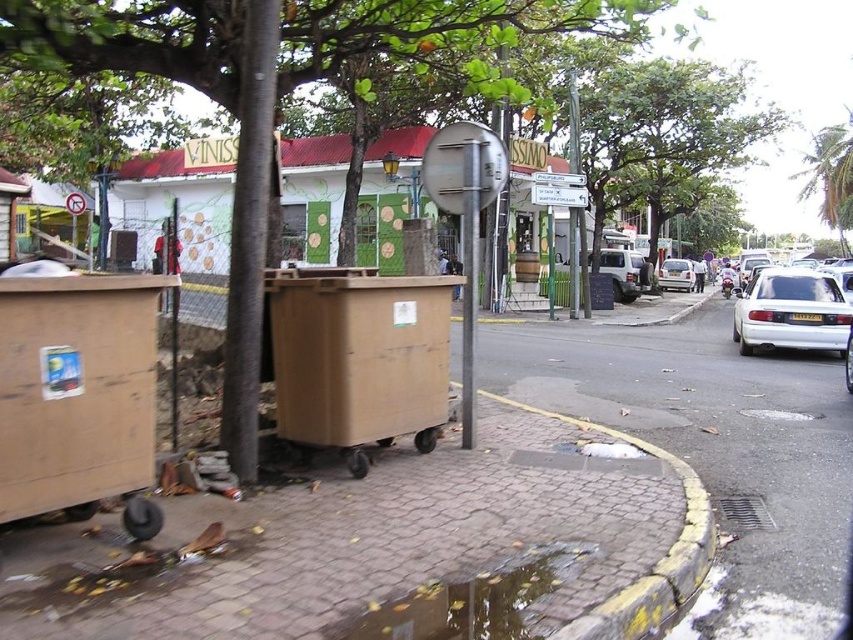
Is reflective wet pavement at lower center taller than green leafy tree at upper center?

No, reflective wet pavement at lower center is not taller than green leafy tree at upper center.

You are a GUI agent. You are given a task and a screenshot of the screen. Output one action in this format:
    pyautogui.click(x=<x>, y=<y>)
    Task: Click on the reflective wet pavement at lower center
    The image size is (853, 640).
    Given the screenshot: What is the action you would take?
    pyautogui.click(x=469, y=602)

Which is in front, point (450, 584) or point (844, 163)?

Positioned in front is point (450, 584).

At what (x,y) coordinates should I click in order to perform the action: click on reflective wet pavement at lower center. Please return your answer as a coordinate pair (x, y). The image size is (853, 640). Looking at the image, I should click on (469, 602).

The image size is (853, 640). Describe the element at coordinates (715, 449) in the screenshot. I see `brick pavement at center` at that location.

Consider the image. Does brick pavement at center have a lesser width compared to white glossy sedan at right?

Yes, brick pavement at center is thinner than white glossy sedan at right.

The width and height of the screenshot is (853, 640). What are the coordinates of `brick pavement at center` in the screenshot? It's located at (715, 449).

Which is more to the left, brown cardboard at center or green leafy tree at center?

From the viewer's perspective, green leafy tree at center appears more on the left side.

Can you confirm if brown cardboard at center is shorter than green leafy tree at center?

No, brown cardboard at center is not shorter than green leafy tree at center.

Which is behind, point (833, 547) or point (306, 67)?

Positioned behind is point (306, 67).

Locate an element on the screen. brown cardboard at center is located at coordinates (368, 547).